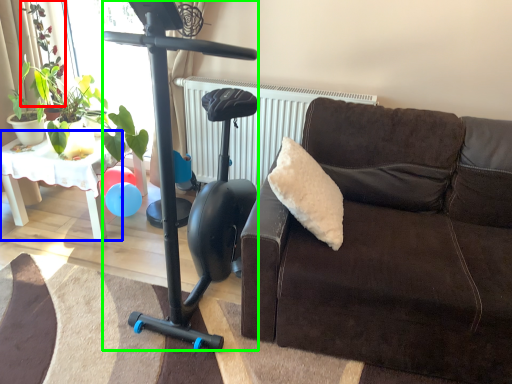
Question: Which is nearer to the plant (highlighted by a red box)? table (highlighted by a blue box) or mobility scooter (highlighted by a green box).

Choices:
 (A) table
 (B) mobility scooter

Answer: (A)